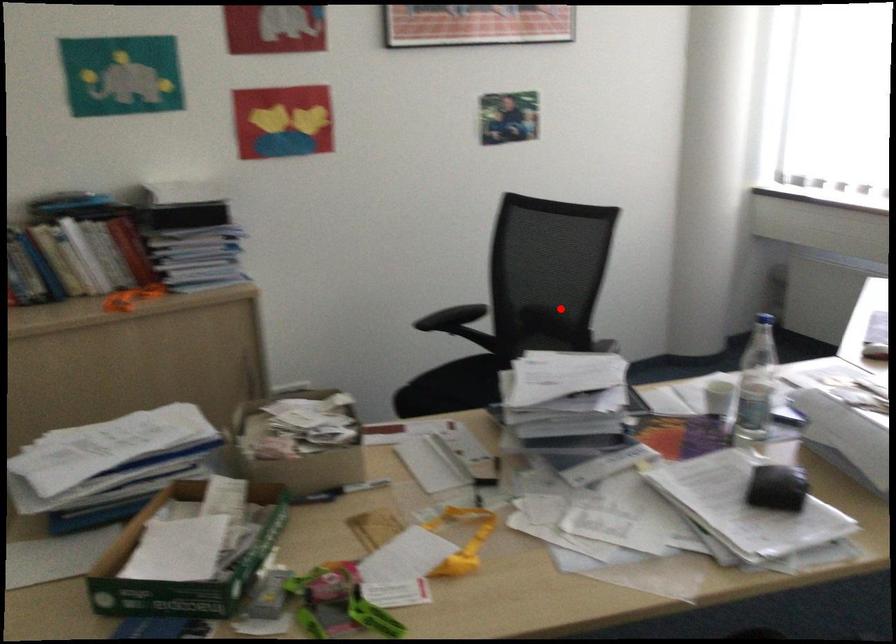
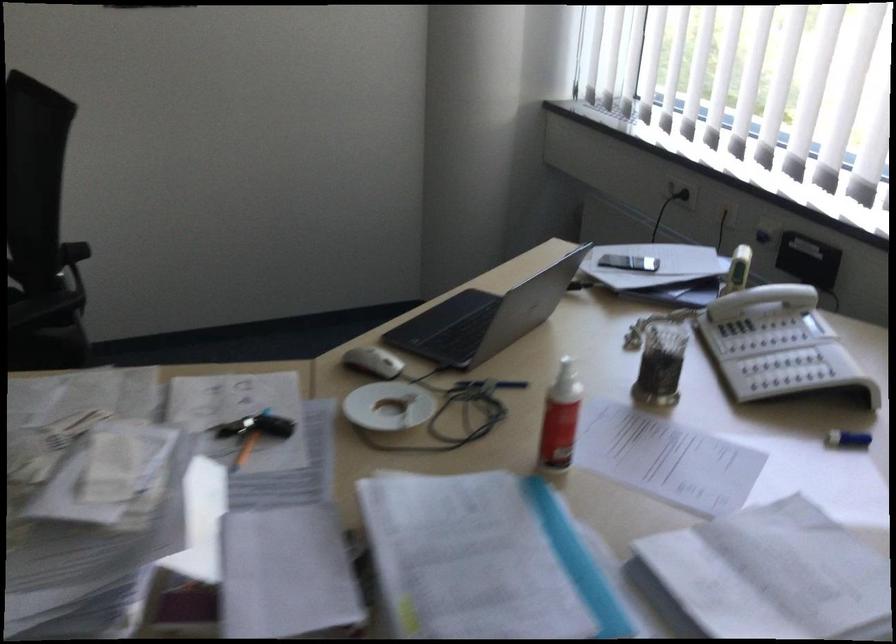
Locate, in the second image, the point that corresponds to the highlighted location in the first image.

(73, 252)